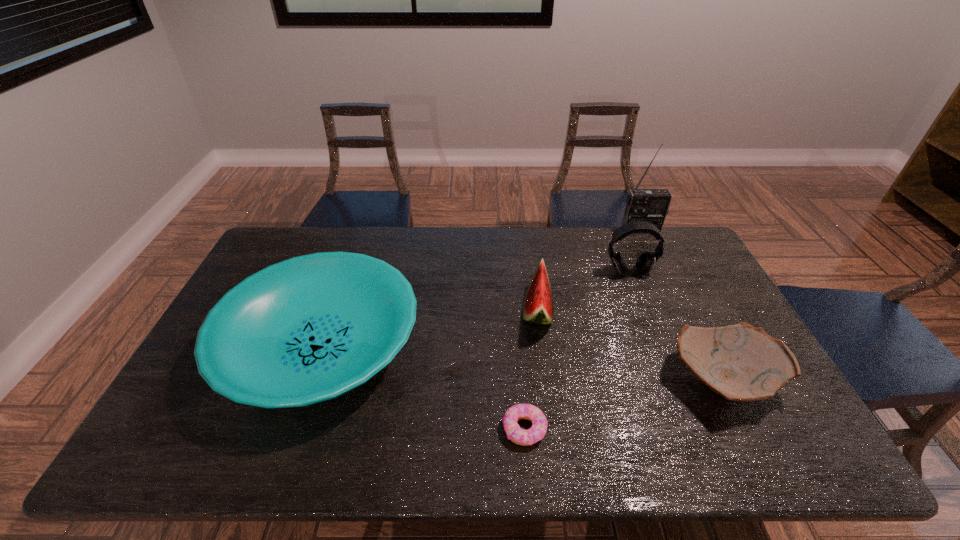
Find the location of `object at the left edge`. object at the left edge is located at coordinates (308, 329).

Find the location of a particular element. radio receiver present at the right edge is located at coordinates (649, 205).

This screenshot has height=540, width=960. What are the coordinates of `pottery present at the right edge` in the screenshot? It's located at (740, 362).

This screenshot has width=960, height=540. Find the location of `object positioned at the near left corner`. object positioned at the near left corner is located at coordinates (308, 329).

In order to click on object present at the far right corner in this screenshot , I will do `click(649, 205)`.

Image resolution: width=960 pixels, height=540 pixels. Identify the location of vacant region at the far edge of the desktop. (555, 239).

You are a GUI agent. You are given a task and a screenshot of the screen. Output one action in this format:
    pyautogui.click(x=<x>, y=<y>)
    Task: Click on the vacant space at the near edge of the desktop
    
    Given the screenshot: What is the action you would take?
    tap(570, 456)

At what (x,y) coordinates should I click in order to perform the action: click on free space at the left edge of the desktop. Please return your answer as a coordinate pair (x, y). The height and width of the screenshot is (540, 960). Looking at the image, I should click on coord(184,427).

Locate an element on the screen. The height and width of the screenshot is (540, 960). vacant position at the right edge of the desktop is located at coordinates (697, 300).

Where is `free space between the dish and the radio receiver`? This screenshot has width=960, height=540. free space between the dish and the radio receiver is located at coordinates (481, 289).